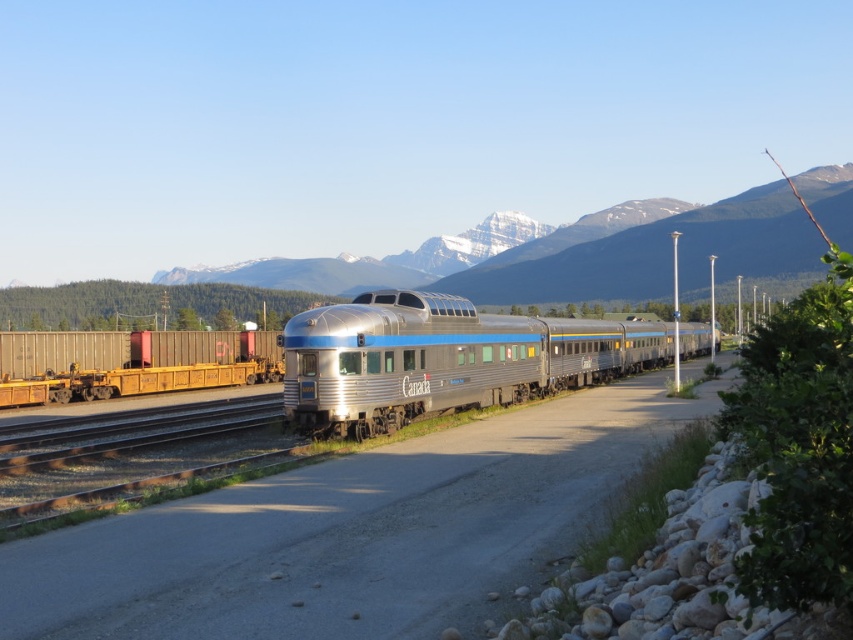
Between silver metallic train at center and snowy mountain at center, which one appears on the left side from the viewer's perspective?

Positioned to the left is snowy mountain at center.

Is silver metallic train at center positioned before snowy mountain at center?

Yes, silver metallic train at center is in front of snowy mountain at center.

Is point (294, 365) in front of point (379, 284)?

Yes.

The width and height of the screenshot is (853, 640). What are the coordinates of `silver metallic train at center` in the screenshot? It's located at point(444,358).